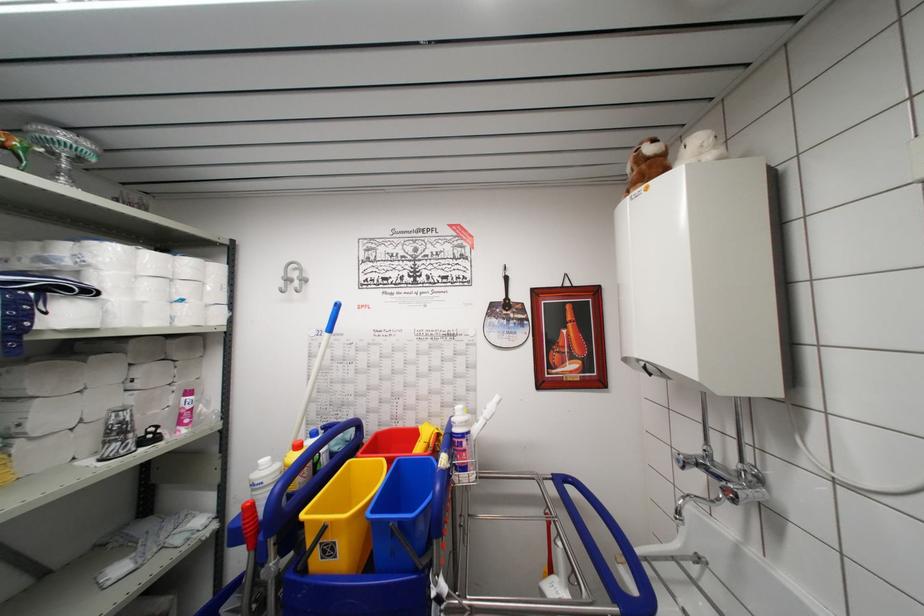
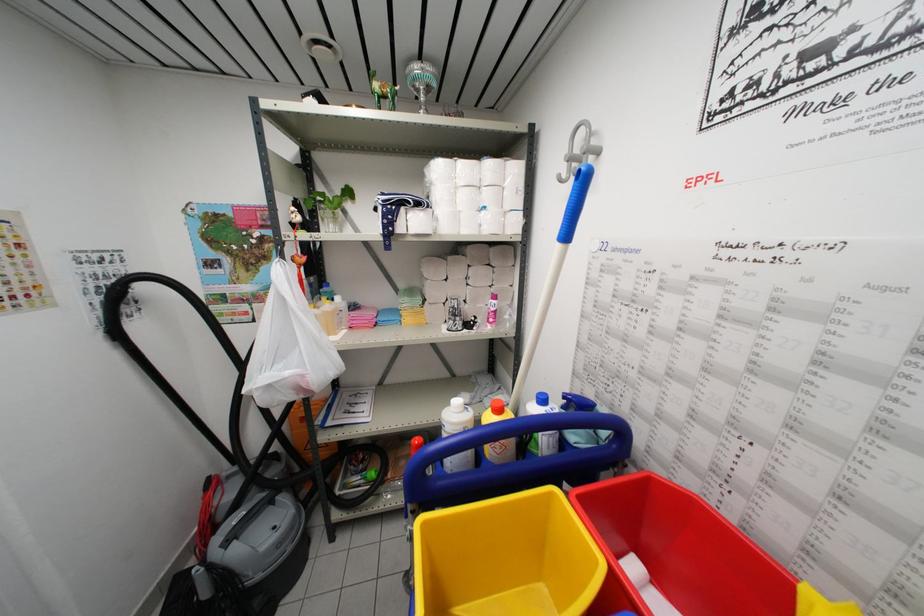
Where in the second image is the point corresponding to pixel 307 280 from the first image?

(597, 148)